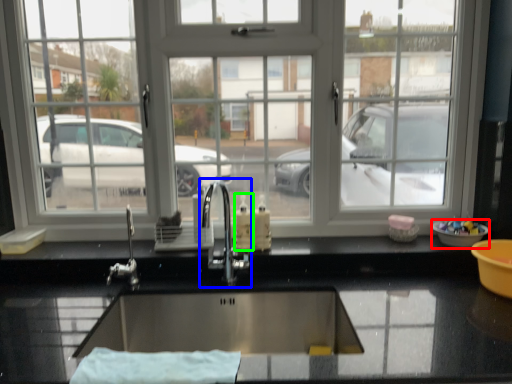
Question: Based on their relative distances, which object is farther from basin (highlighted by a red box)? Choose from tap (highlighted by a blue box) and soap dispenser (highlighted by a green box).

Choices:
 (A) tap
 (B) soap dispenser

Answer: (A)